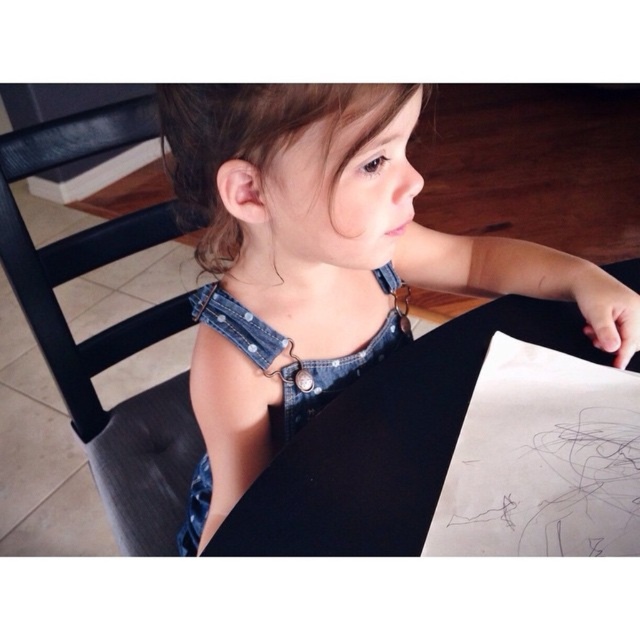
Where is the denim dress at center located in the image?

The denim dress at center is located at point 0.409 on the x axis and 0.506 on the y axis.

You are a parent trying to decide if your child can sit comfortably on the black leather chair at left while wearing the denim dress at center. Based on their heights, can the child reach the seat of the chair?

The denim dress at center is not as tall as the black leather chair at left, so the child wearing the denim dress at center may not be tall enough to comfortably reach the seat of the black leather chair at left without assistance.

You are a photographer setting up a shoot in the room. You need to position a light source to the left of the black leather chair at left and to the right of the denim dress at center. Is this possible based on their positions?

The denim dress at center is to the right of the black leather chair at left, so placing a light source to the left of the black leather chair at left would also be to the left of the denim dress at center. Therefore, it is not possible to position the light source both to the left of the black leather chair at left and to the right of the denim dress at center simultaneously.